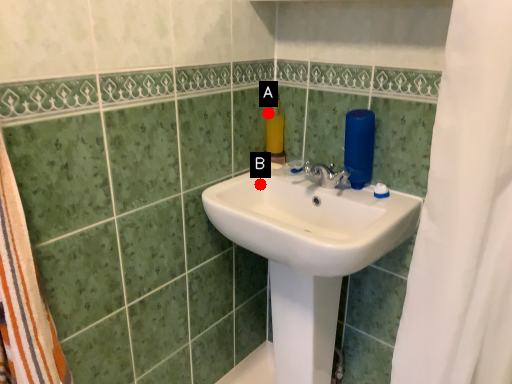
Question: Two points are circled on the image, labeled by A and B beside each circle. Which point is closer to the camera taking this photo?

Choices:
 (A) A is closer
 (B) B is closer

Answer: (B)